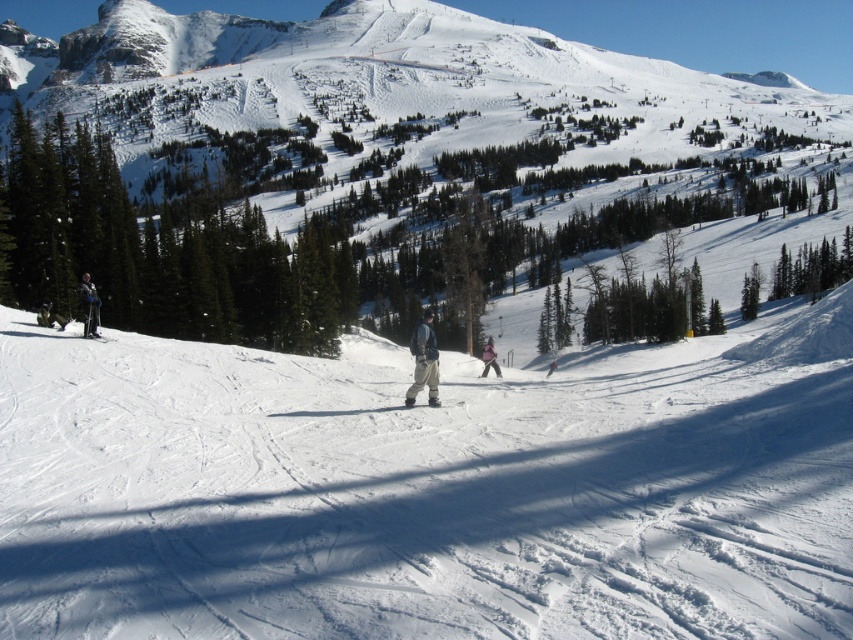
Question: Does matte black skier at left have a smaller size compared to matte black ski at left?

Choices:
 (A) no
 (B) yes

Answer: (A)

Question: Which point is closer to the camera?

Choices:
 (A) (496, 371)
 (B) (434, 406)

Answer: (B)

Question: Which object is closer to the camera taking this photo?

Choices:
 (A) pink fabric jacket at center
 (B) matte black ski at left
 (C) matte black ski at center

Answer: (C)

Question: Is gray fabric jacket at center bigger than matte black ski at center?

Choices:
 (A) yes
 (B) no

Answer: (A)

Question: Which point appears closest to the camera in this image?

Choices:
 (A) (80, 276)
 (B) (91, 339)
 (C) (500, 374)
 (D) (410, 403)

Answer: (D)

Question: Does matte black skier at left appear on the left side of pink fabric jacket at center?

Choices:
 (A) yes
 (B) no

Answer: (A)